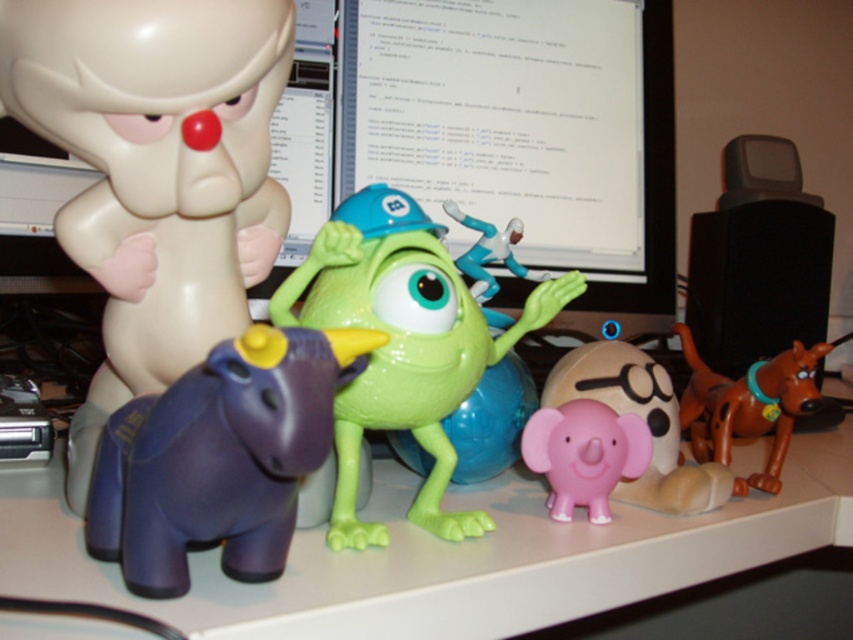
Question: From the image, what is the correct spatial relationship of pink rubber elephant at center in relation to brown rubber dog at right?

Choices:
 (A) right
 (B) left

Answer: (B)

Question: Which point is closer to the camera taking this photo?

Choices:
 (A) (317, 394)
 (B) (779, 435)

Answer: (A)

Question: Which object is positioned closest to the pink rubber elephant at center?

Choices:
 (A) purple matte elephant at lower left
 (B) brown rubber dog at right
 (C) pink matte elephant at center

Answer: (C)

Question: Can you confirm if purple matte elephant at lower left is positioned above pink matte elephant at center?

Choices:
 (A) no
 (B) yes

Answer: (B)

Question: Is green glossy toy monster at center above brown rubber dog at right?

Choices:
 (A) yes
 (B) no

Answer: (A)

Question: Which object is closer to the camera taking this photo?

Choices:
 (A) green glossy toy monster at center
 (B) purple matte elephant at lower left

Answer: (B)